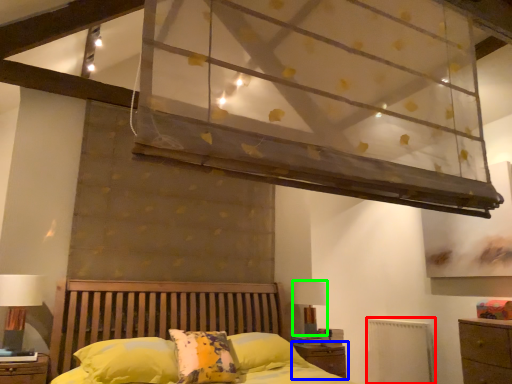
Question: Considering the real-world distances, which object is farthest from radiator (highlighted by a red box)? nightstand (highlighted by a blue box) or table lamp (highlighted by a green box)?

Choices:
 (A) nightstand
 (B) table lamp

Answer: (B)